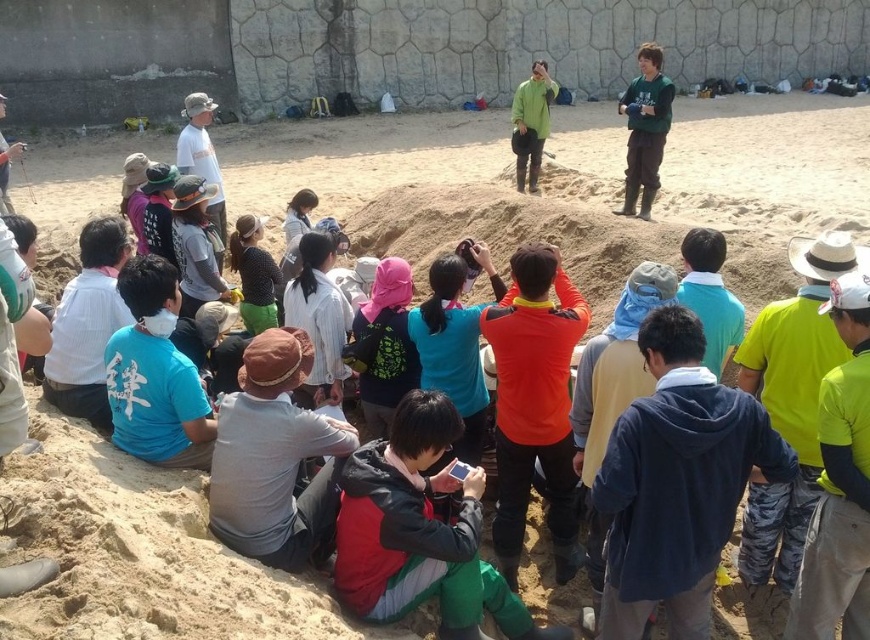
You are a photographer trying to capture a clear shot of both the green matte jacket at upper right and the green matte jacket at center. Based on their heights, which jacket should you focus on first to ensure it doesn t get obscured by the other?

The green matte jacket at upper right is taller than the green matte jacket at center. To prevent the shorter jacket from being obscured, focus on the green matte jacket at center first.

You are standing at the center of the sandy area and want to reach both the point at coordinates point (630, 200) and point (524, 100). Which point should you reach first to minimize the distance walked?

Point (630, 200) is closer to the viewer than point (524, 100), so you should reach point (630, 200) first to minimize the distance walked.